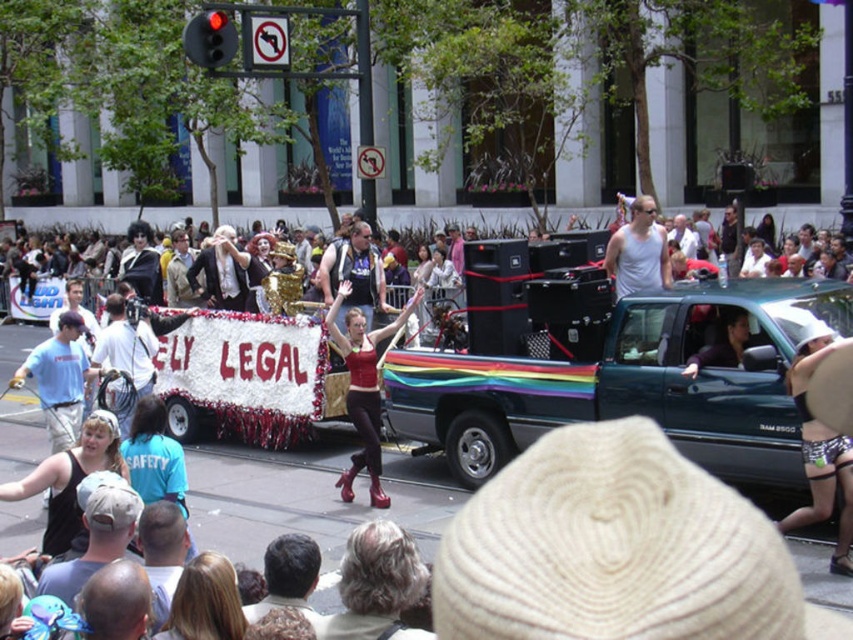
Does shiny red boots at center appear over matte black tank top at center?

Incorrect, shiny red boots at center is not positioned above matte black tank top at center.

Can you confirm if shiny red boots at center is wider than matte black tank top at center?

Correct, the width of shiny red boots at center exceeds that of matte black tank top at center.

Does point (367, 413) lie behind point (364, 314)?

No, it is not.

At what (x,y) coordinates should I click in order to perform the action: click on shiny red boots at center. Please return your answer as a coordinate pair (x, y). Looking at the image, I should click on (363, 388).

Is shiny red boots at center behind shiny black wig at left?

No, it is in front of shiny black wig at left.

Does point (376, 497) come behind point (119, 276)?

That is False.

Which is behind, point (354, 394) or point (146, 282)?

Point (146, 282)

Identify the location of shiny red boots at center. (363, 388).

Can you confirm if matte black tank top at center is shorter than shiny black wig at left?

Yes, matte black tank top at center is shorter than shiny black wig at left.

Between point (383, 305) and point (125, 250), which one is positioned in front?

Positioned in front is point (383, 305).

Image resolution: width=853 pixels, height=640 pixels. Find the location of `matte black tank top at center`. matte black tank top at center is located at coordinates (352, 275).